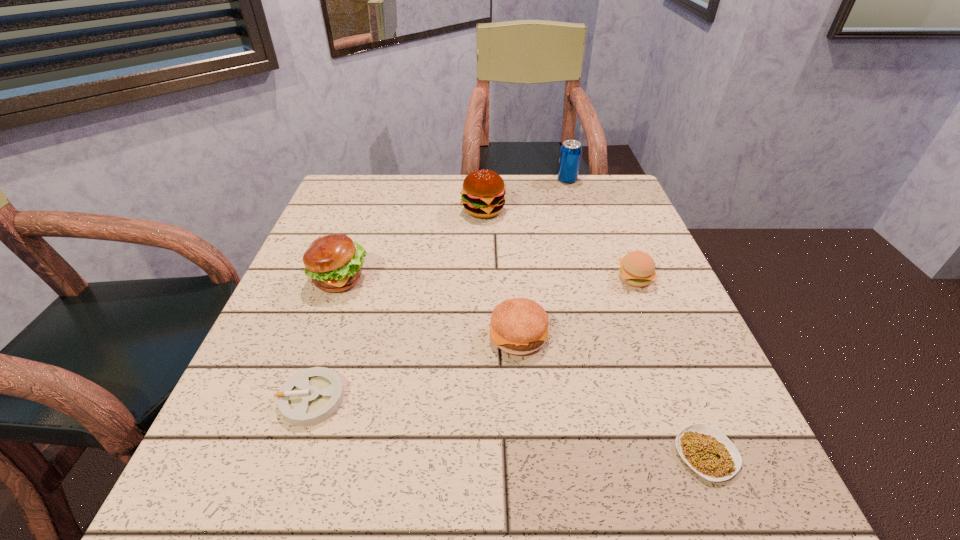
At what (x,y) coordinates should I click in order to perform the action: click on free point between the leftmost hamburger and the fifth object from left to right. Please return your answer as a coordinate pair (x, y). Looking at the image, I should click on (453, 229).

Identify the location of vacant area that lies between the nearest hamburger and the leftmost hamburger. (429, 307).

The image size is (960, 540). What are the coordinates of `vacant area that lies between the sixth nearest object and the ashtray` in the screenshot? It's located at (398, 305).

Locate an element on the screen. Image resolution: width=960 pixels, height=540 pixels. free space that is in between the legume and the third nearest object is located at coordinates (612, 394).

Where is `empty space that is in between the rightmost hamburger and the nearest hamburger`? The width and height of the screenshot is (960, 540). empty space that is in between the rightmost hamburger and the nearest hamburger is located at coordinates (577, 306).

The image size is (960, 540). I want to click on empty space between the leftmost hamburger and the legume, so click(x=523, y=367).

Locate an element on the screen. free space between the second farthest object and the third nearest object is located at coordinates (501, 272).

Locate an element on the screen. This screenshot has width=960, height=540. free space that is in between the third nearest object and the sixth tallest object is located at coordinates (416, 367).

I want to click on unoccupied position between the farthest object and the shortest object, so click(x=636, y=317).

Identify which object is the second closest to the leftmost hamburger. Please provide its 2D coordinates. Your answer should be formatted as a tuple, i.e. [(x, y)], where the tuple contains the x and y coordinates of a point satisfying the conditions above.

[(483, 195)]